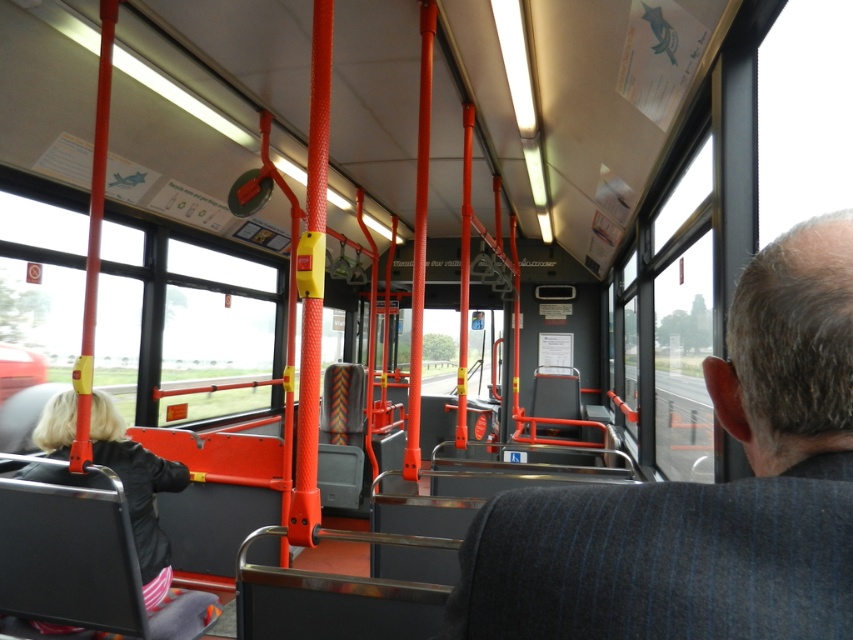
Question: Which object is farther from the camera taking this photo?

Choices:
 (A) matte black coach at center
 (B) transparent glass window at center

Answer: (B)

Question: Is transparent glass window at center in front of black fabric jacket at lower left?

Choices:
 (A) yes
 (B) no

Answer: (B)

Question: Which point is closer to the camera?

Choices:
 (A) (769, 589)
 (B) (212, 609)

Answer: (A)

Question: Which point is closer to the camera?

Choices:
 (A) (206, 294)
 (B) (45, 442)

Answer: (B)

Question: Is matte black coach at center to the right of transparent glass window at center from the viewer's perspective?

Choices:
 (A) no
 (B) yes

Answer: (B)

Question: Does matte black coach at center have a lesser width compared to transparent glass window at center?

Choices:
 (A) no
 (B) yes

Answer: (B)